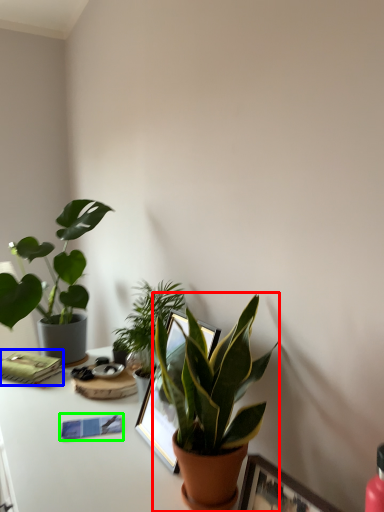
Question: Considering the real-world distances, which object is farthest from houseplant (highlighted by a red box)? paperback book (highlighted by a blue box) or journal (highlighted by a green box)?

Choices:
 (A) paperback book
 (B) journal

Answer: (A)